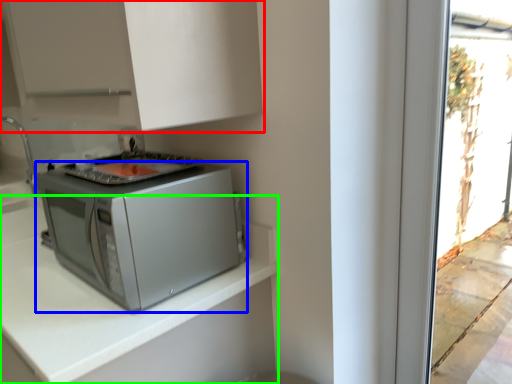
Question: Which object is positioned closest to cabinetry (highlighted by a red box)? Select from home appliance (highlighted by a blue box) and countertop (highlighted by a green box).

Choices:
 (A) home appliance
 (B) countertop

Answer: (A)